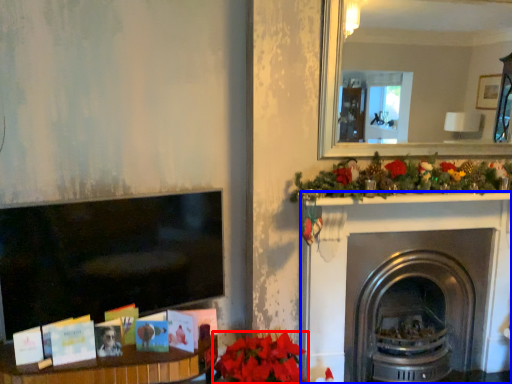
Question: Among these objects, which one is nearest to the camera, flower (highlighted by a red box) or fireplace (highlighted by a blue box)?

Choices:
 (A) flower
 (B) fireplace

Answer: (A)